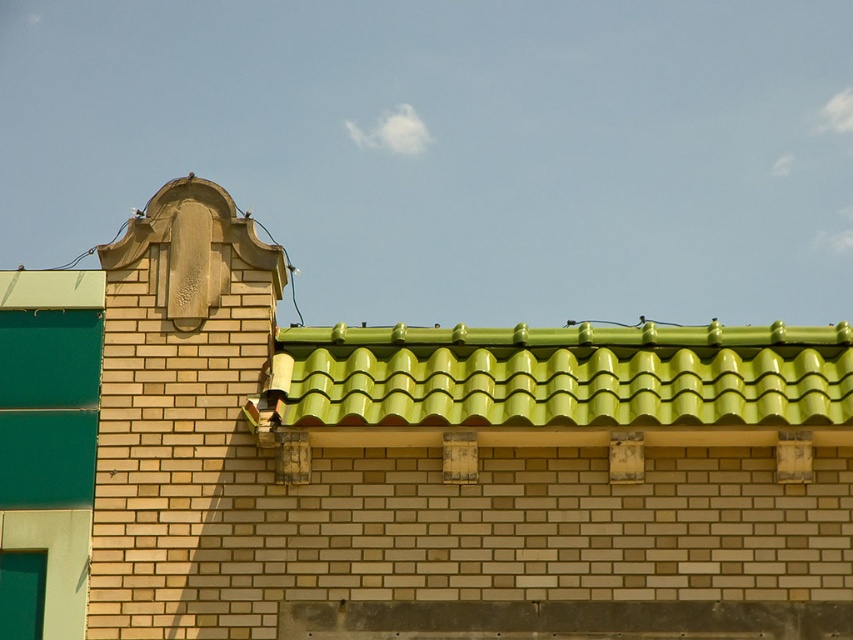
You are standing in front of the building and notice a specific point marked at coordinates (450, 461). Which architectural feature is located at that point?

The green glazed tiles at upper center is located at point (450, 461).

You are a window cleaner standing on a platform that can only move horizontally. You need to clean both the green glazed tiles at upper center and the green glossy tiles at upper center. Given that your platform can reach 18 inches in total, can you clean both without moving the platform?

The green glazed tiles at upper center and green glossy tiles at upper center are 17.90 inches apart from each other. Since the platform can reach 18 inches, you can clean both without moving the platform because the distance between them is within the platform reach.